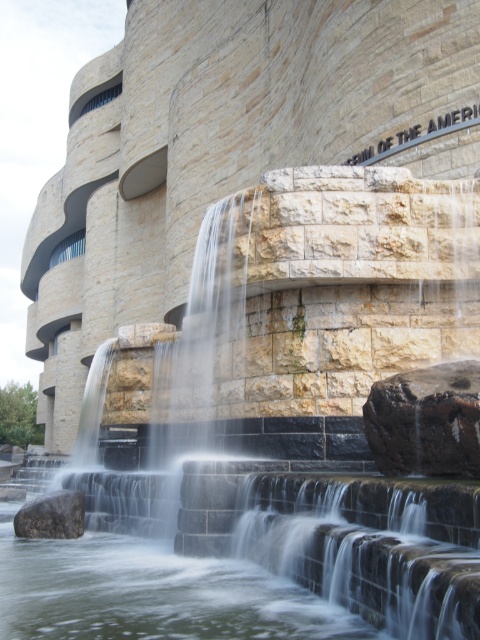
Between smooth stone waterfall at center and brown rough rock at lower left, which one appears on the right side from the viewer's perspective?

From the viewer's perspective, smooth stone waterfall at center appears more on the right side.

Can you confirm if smooth stone waterfall at center is positioned to the left of brown rough rock at lower left?

In fact, smooth stone waterfall at center is to the right of brown rough rock at lower left.

Is point (292, 337) farther from viewer compared to point (24, 516)?

No, (292, 337) is closer to viewer.

At what (x,y) coordinates should I click in order to perform the action: click on smooth stone waterfall at center. Please return your answer as a coordinate pair (x, y). The image size is (480, 640). Looking at the image, I should click on (277, 435).

Which is behind, point (460, 596) or point (69, 529)?

Positioned behind is point (69, 529).

Can you confirm if clear stone water at center is positioned above brown rough rock at lower left?

Indeed, clear stone water at center is positioned over brown rough rock at lower left.

Does point (172, 497) lie in front of point (39, 518)?

Yes, point (172, 497) is in front of point (39, 518).

Identify the location of clear stone water at center. Image resolution: width=480 pixels, height=640 pixels. 248,561.

Which is below, smooth stone waterfall at center or dark brown rock at center?

smooth stone waterfall at center is lower down.

Who is more distant from viewer, (x=340, y=518) or (x=456, y=420)?

Positioned behind is point (x=340, y=518).

Is point (115, 500) closer to camera compared to point (396, 460)?

No, it is not.

Where is `smooth stone waterfall at center`? smooth stone waterfall at center is located at coordinates (277, 435).